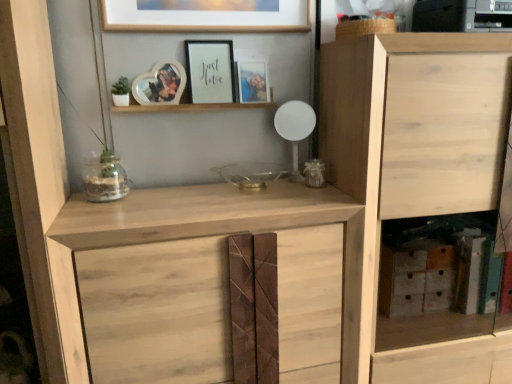
Question: From the image's perspective, does natural wood cabinet at right, which is the first cupboard from right to left, appear higher than matte wooden photo frame at upper center, arranged as the first picture frame when viewed from the right?

Choices:
 (A) yes
 (B) no

Answer: (B)

Question: Is natural wood cabinet at right, the second cupboard in the left-to-right sequence, at the left side of matte wooden photo frame at upper center, arranged as the first picture frame when viewed from the right?

Choices:
 (A) yes
 (B) no

Answer: (B)

Question: Is matte wooden photo frame at upper center, acting as the 3th picture frame starting from the left, inside natural wood cabinet at right, the second cupboard in the left-to-right sequence?

Choices:
 (A) no
 (B) yes

Answer: (A)

Question: Is the depth of natural wood cabinet at right, the second cupboard in the left-to-right sequence, greater than that of matte wooden photo frame at upper center, arranged as the first picture frame when viewed from the right?

Choices:
 (A) no
 (B) yes

Answer: (A)

Question: Is natural wood cabinet at right, which is the first cupboard from right to left, thinner than matte wooden photo frame at upper center, acting as the 3th picture frame starting from the left?

Choices:
 (A) no
 (B) yes

Answer: (A)

Question: Relative to wooden heart-shaped photo frame at upper center, which ranks as the third picture frame in right-to-left order, is clear glass vase at center in front or behind?

Choices:
 (A) behind
 (B) front

Answer: (B)

Question: Which is correct: clear glass vase at center is inside wooden heart-shaped photo frame at upper center, which ranks as the third picture frame in right-to-left order, or outside of it?

Choices:
 (A) outside
 (B) inside

Answer: (A)

Question: Is point (115, 162) closer or farther from the camera than point (150, 81)?

Choices:
 (A) closer
 (B) farther

Answer: (A)

Question: From a real-world perspective, is clear glass vase at center above or below wooden heart-shaped photo frame at upper center, which ranks as the third picture frame in right-to-left order?

Choices:
 (A) above
 (B) below

Answer: (B)

Question: Does point (314, 223) appear closer or farther from the camera than point (351, 110)?

Choices:
 (A) closer
 (B) farther

Answer: (A)

Question: Is natural wood cupboard at center, the second cupboard positioned from the right, taller or shorter than natural wood cabinet at right, which is the first cupboard from right to left?

Choices:
 (A) short
 (B) tall

Answer: (A)

Question: From a real-world perspective, is natural wood cupboard at center, the second cupboard positioned from the right, positioned above or below natural wood cabinet at right, the second cupboard in the left-to-right sequence?

Choices:
 (A) below
 (B) above

Answer: (A)

Question: Based on their positions, is natural wood cupboard at center, positioned as the first cupboard in left-to-right order, located to the left or right of natural wood cabinet at right, the second cupboard in the left-to-right sequence?

Choices:
 (A) right
 (B) left

Answer: (B)

Question: Visually, is matte white frame at upper center, which is counted as the 2th picture frame, starting from the left, positioned to the left or to the right of natural wood cupboard at center, positioned as the first cupboard in left-to-right order?

Choices:
 (A) left
 (B) right

Answer: (A)

Question: From the image's perspective, is matte white frame at upper center, which is counted as the 2th picture frame, starting from the left, positioned above or below natural wood cupboard at center, positioned as the first cupboard in left-to-right order?

Choices:
 (A) above
 (B) below

Answer: (A)